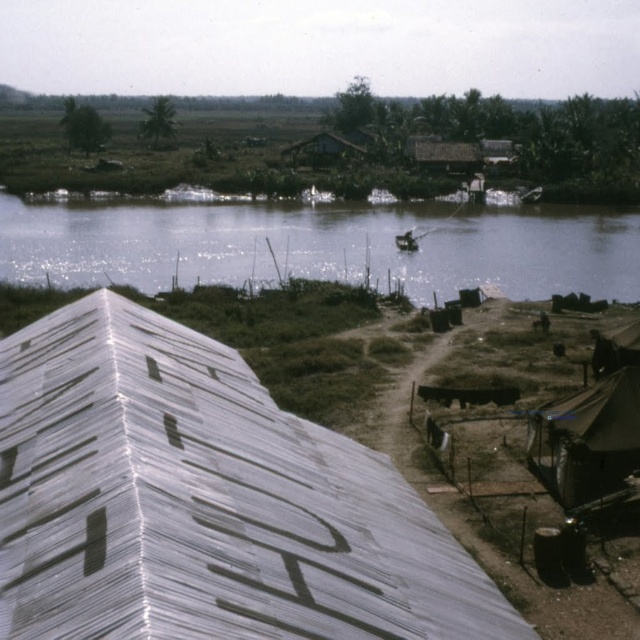
Looking at this image, you are standing on the rooftop and want to observe both the clear water at center and the dark brown canvas tent at lower right. Which object is closer to you?

The dark brown canvas tent at lower right is closer to you because the clear water at center is further to the viewer than the dark brown canvas tent at lower right.

You are standing on the rooftop and want to get to the clear water at center. Which direction should you move relative to the metallic corrugated roof at upper left?

Since the metallic corrugated roof at upper left is located below the clear water at center, you should move downward away from the metallic corrugated roof at upper left to reach the clear water at center.